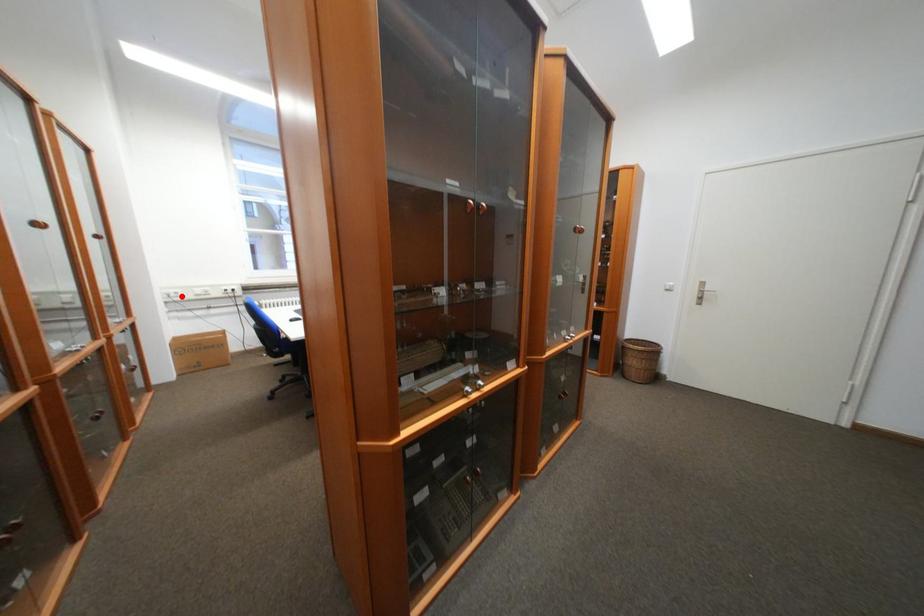
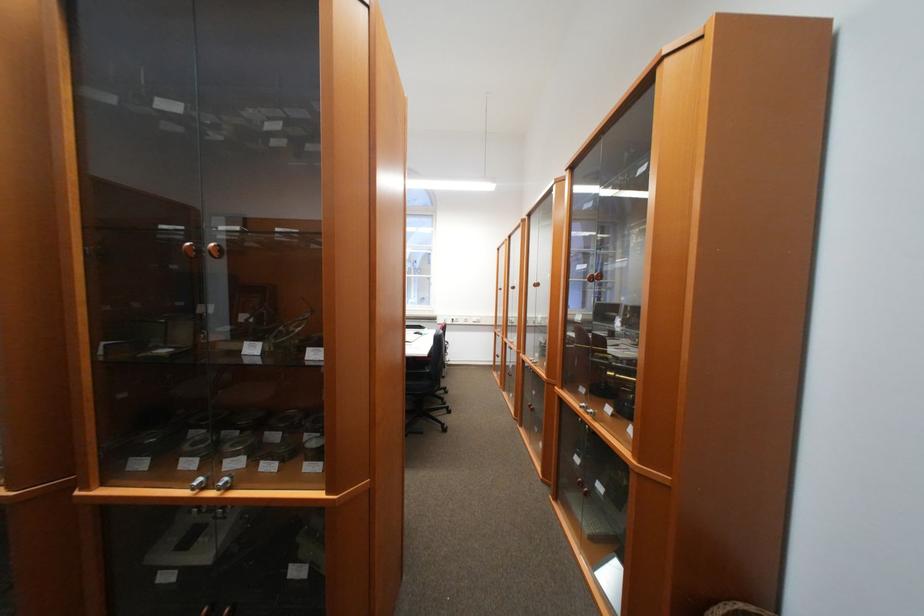
Question: I am providing you with two images of the same scene from different viewpoints. A red point is marked on the first image. At the location where the point appears in image 1, is it still visible in image 2?

Choices:
 (A) Yes
 (B) No

Answer: (B)